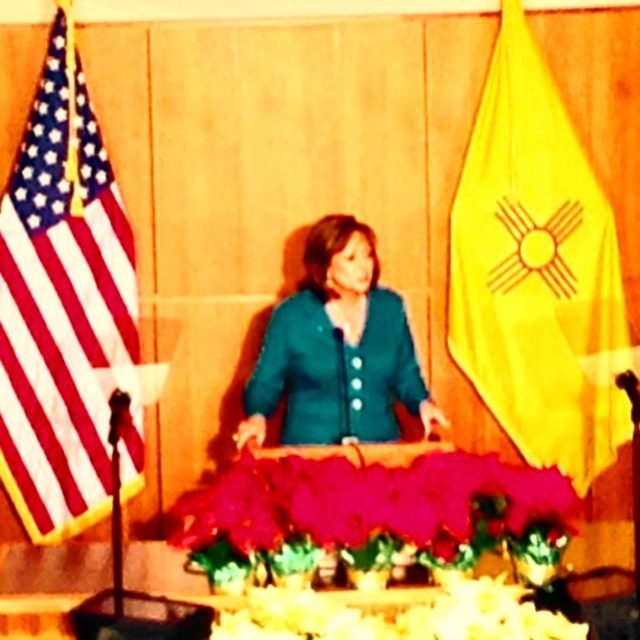
Question: Can you confirm if yellow fabric flag at right is wider than american flag at left?

Choices:
 (A) yes
 (B) no

Answer: (A)

Question: Estimate the real-world distances between objects in this image. Which object is closer to the silky pink petals at center?

Choices:
 (A) white matte flowers at lower center
 (B) teal fabric jacket at center
 (C) american flag at left

Answer: (A)

Question: Which point is closer to the camera taking this photo?

Choices:
 (A) (356, 240)
 (B) (561, 248)

Answer: (A)

Question: Which object appears farthest from the camera in this image?

Choices:
 (A) yellow fabric flag at right
 (B) teal fabric jacket at center

Answer: (A)

Question: Can you confirm if american flag at left is smaller than white matte flowers at lower center?

Choices:
 (A) no
 (B) yes

Answer: (A)

Question: Can you confirm if silky pink petals at center is positioned below teal fabric jacket at center?

Choices:
 (A) no
 (B) yes

Answer: (B)